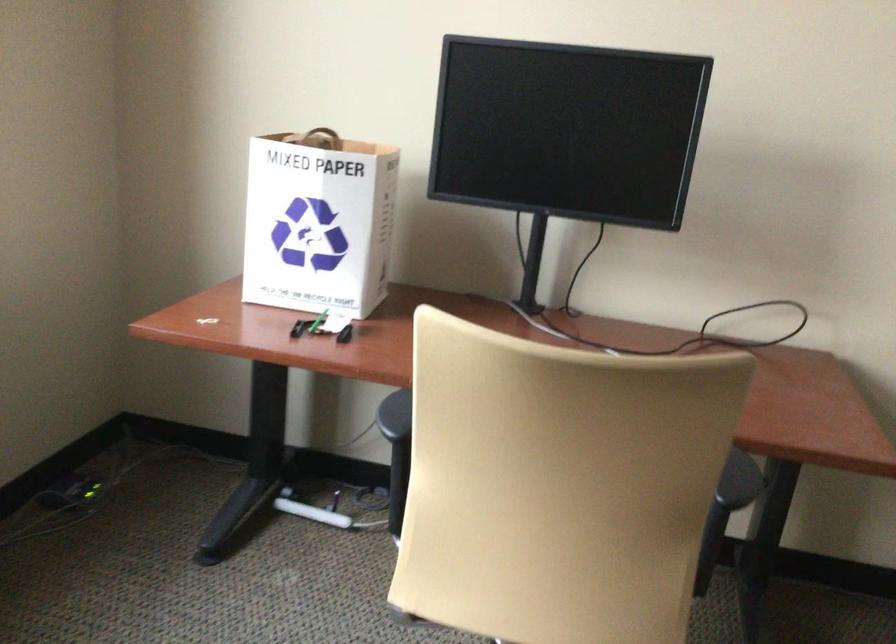
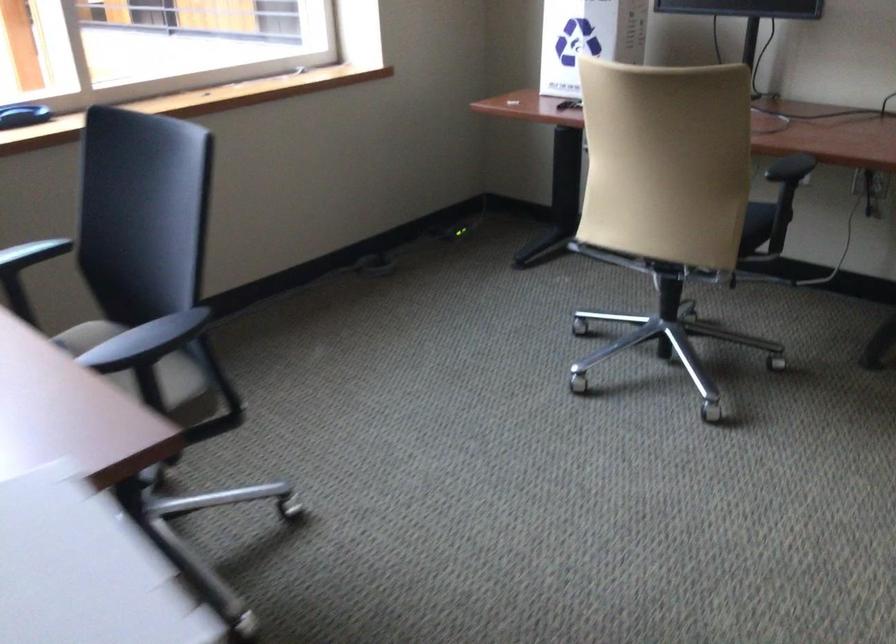
Locate, in the second image, the point that corresponds to pixel 726 489 in the first image.

(790, 167)